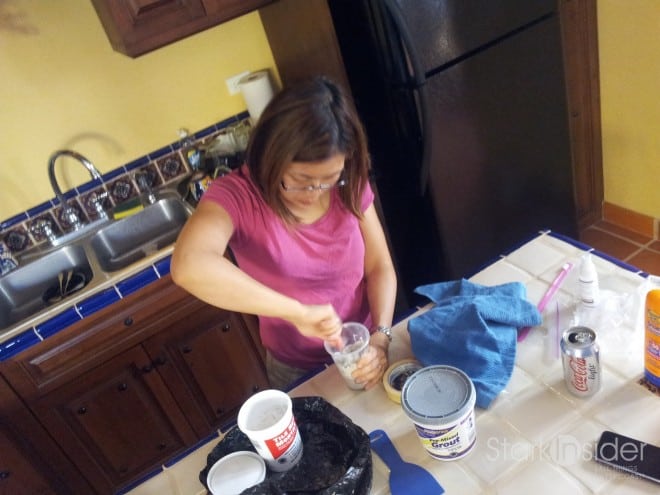
This screenshot has height=495, width=660. In order to click on faucet in this screenshot , I will do pyautogui.click(x=94, y=174), pyautogui.click(x=53, y=178).